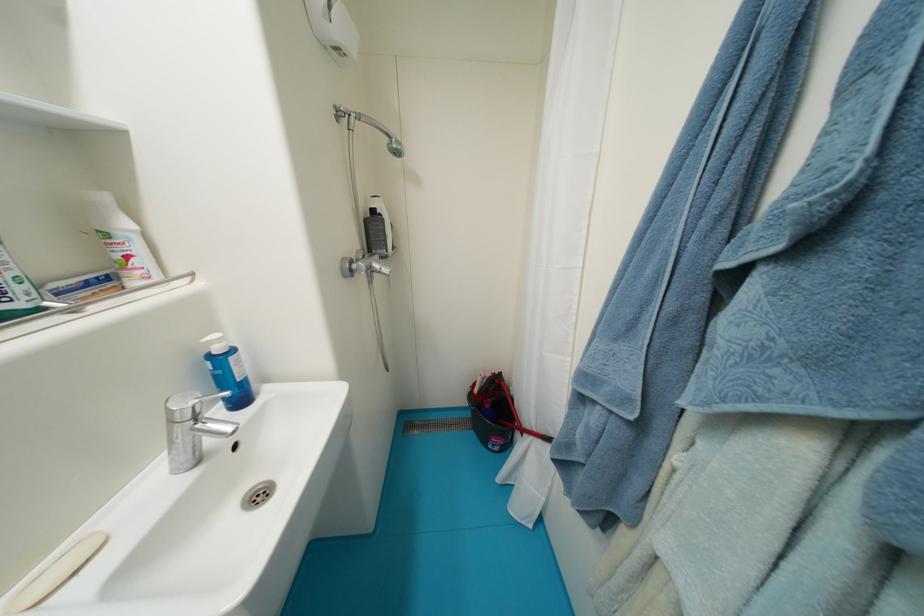
Find where to lift the black bucket handle. Please return your answer as a coordinate pair (x, y).

(491, 416)